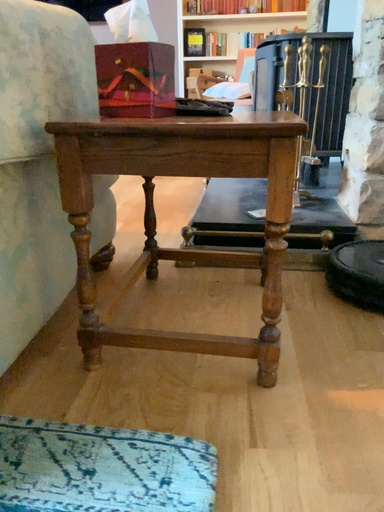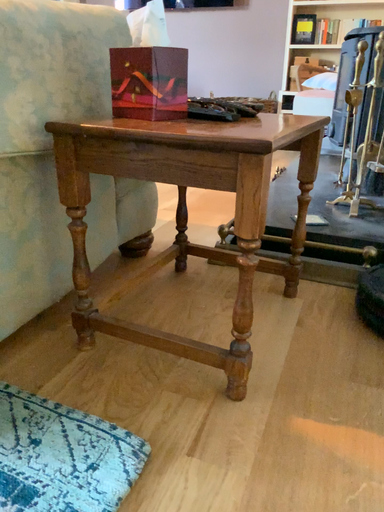
Question: How did the camera likely rotate when shooting the video?

Choices:
 (A) rotated right
 (B) rotated left

Answer: (B)